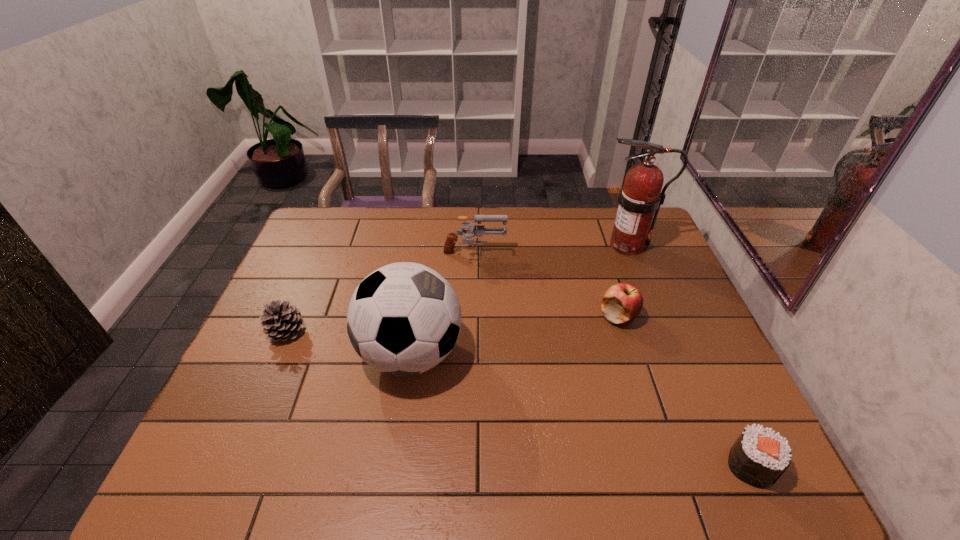
Where is `sushi that is at the right edge`? The image size is (960, 540). sushi that is at the right edge is located at coordinates (759, 457).

The height and width of the screenshot is (540, 960). I want to click on object located in the far right corner section of the desktop, so click(640, 197).

Where is `object that is at the near right corner`? The image size is (960, 540). object that is at the near right corner is located at coordinates (759, 457).

The width and height of the screenshot is (960, 540). Find the location of `vacant space at the far edge of the desktop`. vacant space at the far edge of the desktop is located at coordinates (485, 211).

Locate an element on the screen. The image size is (960, 540). vacant space at the near edge of the desktop is located at coordinates (411, 467).

Locate an element on the screen. vacant space at the left edge is located at coordinates (255, 392).

This screenshot has width=960, height=540. I want to click on vacant space at the right edge of the desktop, so click(684, 390).

Locate an element on the screen. The height and width of the screenshot is (540, 960). free space at the far left corner is located at coordinates (302, 246).

I want to click on free spot at the near left corner of the desktop, so click(254, 457).

You are a GUI agent. You are given a task and a screenshot of the screen. Output one action in this format:
    pyautogui.click(x=<x>, y=<y>)
    Task: Click on the vacant area that lies between the pinecone and the second tallest object
    The width and height of the screenshot is (960, 540).
    Given the screenshot: What is the action you would take?
    pyautogui.click(x=348, y=343)